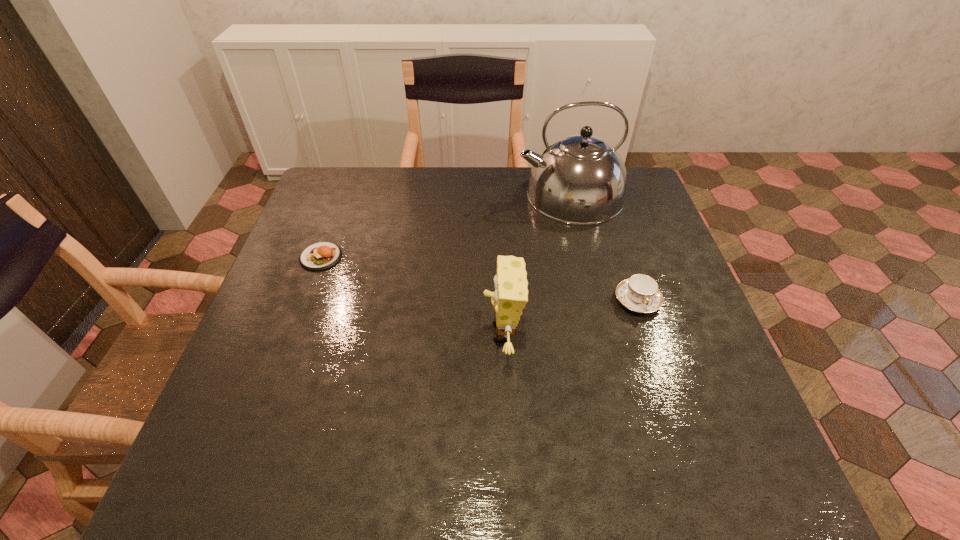
Image resolution: width=960 pixels, height=540 pixels. Identify the location of free location that satisfies the following two spatial constraints: 1. on the side with the handle of the teacup; 2. on the face of the second tallest object. (648, 332).